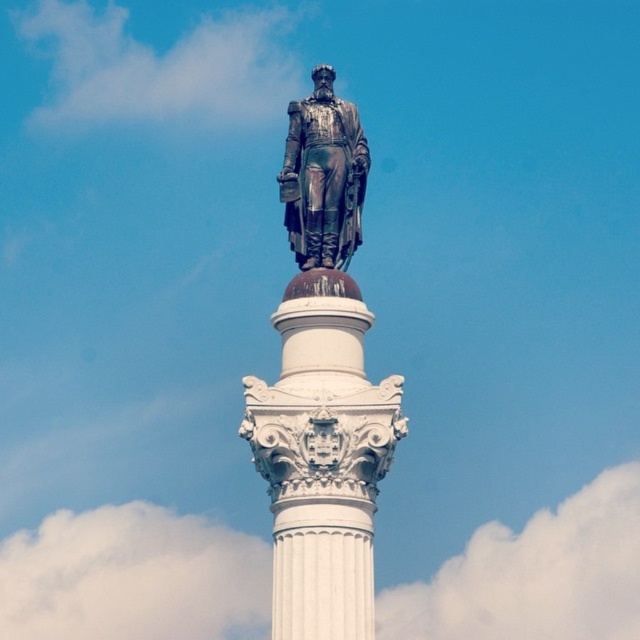
Question: Does white marble column at center appear on the left side of bronze statue at center?

Choices:
 (A) yes
 (B) no

Answer: (A)

Question: Can you confirm if white marble column at center is positioned to the left of bronze statue at center?

Choices:
 (A) no
 (B) yes

Answer: (B)

Question: Which point is farther from the camera taking this photo?

Choices:
 (A) (244, 412)
 (B) (355, 172)

Answer: (B)

Question: Which point is closer to the camera taking this photo?

Choices:
 (A) (346, 129)
 (B) (292, 337)

Answer: (B)

Question: Does white marble column at center lie behind bronze statue at center?

Choices:
 (A) yes
 (B) no

Answer: (B)

Question: Which of the following is the closest to the observer?

Choices:
 (A) (301, 269)
 (B) (301, 456)

Answer: (B)